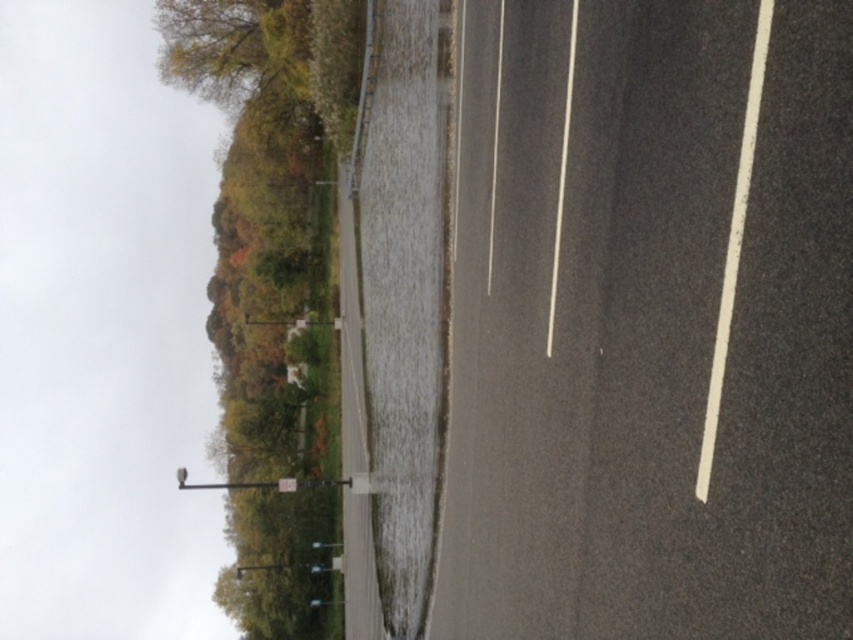
Is black asphalt highway at center taller than green leafy tree at upper left?

Incorrect, black asphalt highway at center's height is not larger of green leafy tree at upper left's.

Between black asphalt highway at center and green leafy tree at upper left, which one has less height?

black asphalt highway at center

This screenshot has height=640, width=853. I want to click on black asphalt highway at center, so click(x=650, y=323).